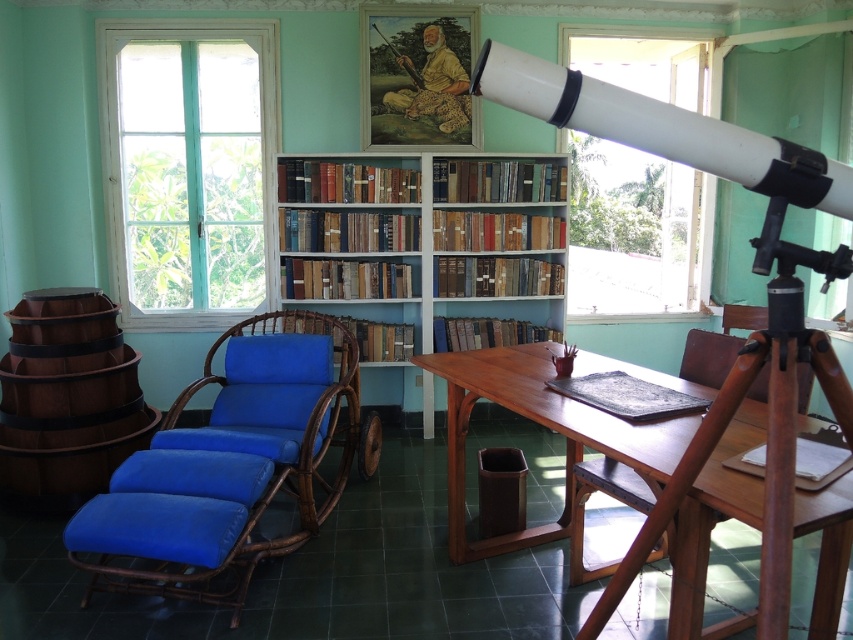
Question: Among these objects, which one is nearest to the camera?

Choices:
 (A) white wooden window at left
 (B) transparent glass window at upper right

Answer: (A)

Question: Does white wooden window at left have a lesser width compared to blue woven armchair at center?

Choices:
 (A) no
 (B) yes

Answer: (B)

Question: Among these objects, which one is farthest from the camera?

Choices:
 (A) transparent glass window at upper right
 (B) blue fabric armchair at center
 (C) wooden table at center
 (D) white wooden window at left

Answer: (A)

Question: Among these objects, which one is nearest to the camera?

Choices:
 (A) transparent glass window at upper right
 (B) wooden bookcase at center

Answer: (B)

Question: Does transparent glass window at upper right appear under blue fabric armchair at center?

Choices:
 (A) yes
 (B) no

Answer: (B)

Question: Where is blue woven armchair at center located in relation to blue fabric armchair at center in the image?

Choices:
 (A) right
 (B) left

Answer: (B)